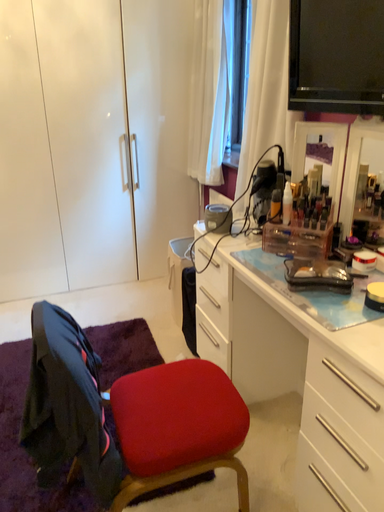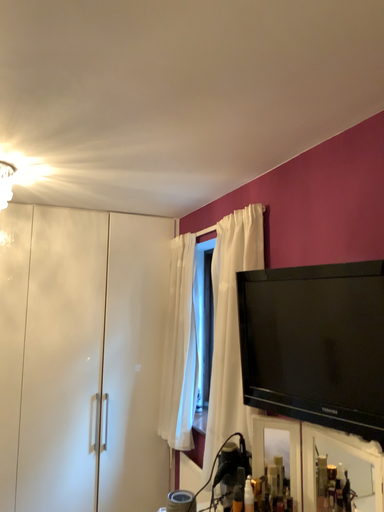
Question: Which way did the camera rotate in the video?

Choices:
 (A) rotated downward
 (B) rotated upward

Answer: (B)